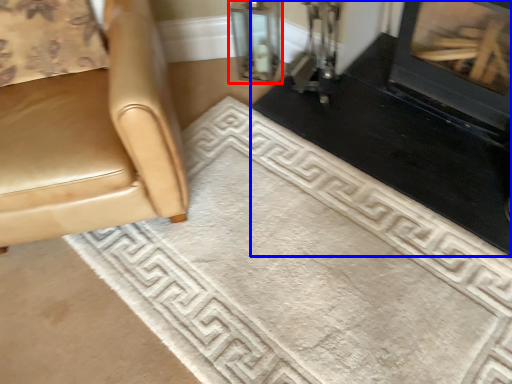
Question: Among these objects, which one is farthest to the camera, glass door (highlighted by a red box) or fireplace (highlighted by a blue box)?

Choices:
 (A) glass door
 (B) fireplace

Answer: (A)